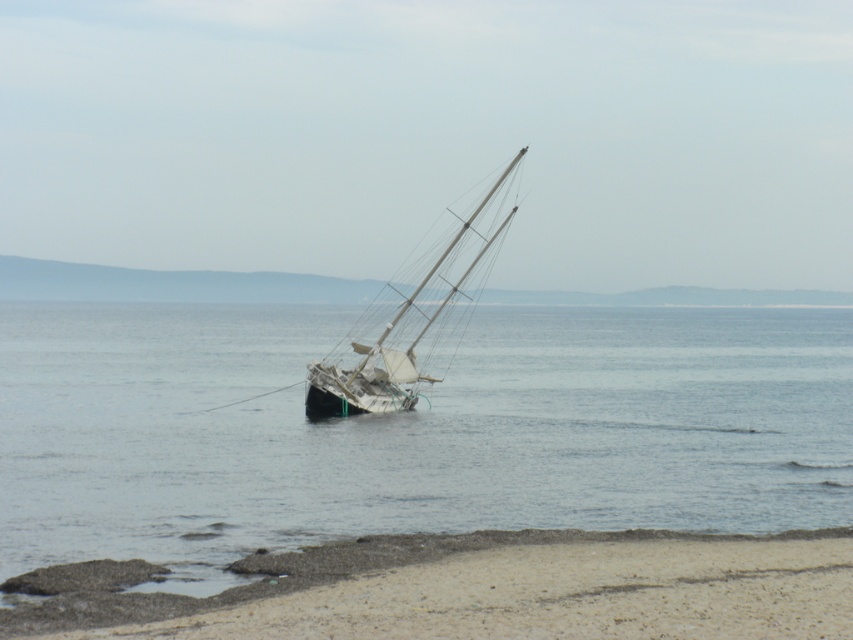
Does sandy beach at lower center have a smaller size compared to white matte sailboat at center?

Yes, sandy beach at lower center is smaller than white matte sailboat at center.

Does sandy beach at lower center appear on the left side of white matte sailboat at center?

In fact, sandy beach at lower center is to the right of white matte sailboat at center.

Does point (547, 548) come in front of point (399, 298)?

Yes, point (547, 548) is in front of point (399, 298).

You are a GUI agent. You are given a task and a screenshot of the screen. Output one action in this format:
    pyautogui.click(x=<x>, y=<y>)
    Task: Click on the sandy beach at lower center
    The image size is (853, 640).
    Given the screenshot: What is the action you would take?
    pyautogui.click(x=473, y=589)

Does transparent water at center have a greater height compared to white matte sailboat at center?

No, transparent water at center is not taller than white matte sailboat at center.

Which is above, transparent water at center or white matte sailboat at center?

white matte sailboat at center is higher up.

Identify the location of transparent water at center. The height and width of the screenshot is (640, 853). (409, 429).

Does transparent water at center have a smaller size compared to sandy beach at lower center?

No, transparent water at center is not smaller than sandy beach at lower center.

Between point (693, 394) and point (363, 557), which one is positioned behind?

Point (693, 394)

Where is `transparent water at center`? The height and width of the screenshot is (640, 853). transparent water at center is located at coordinates (409, 429).